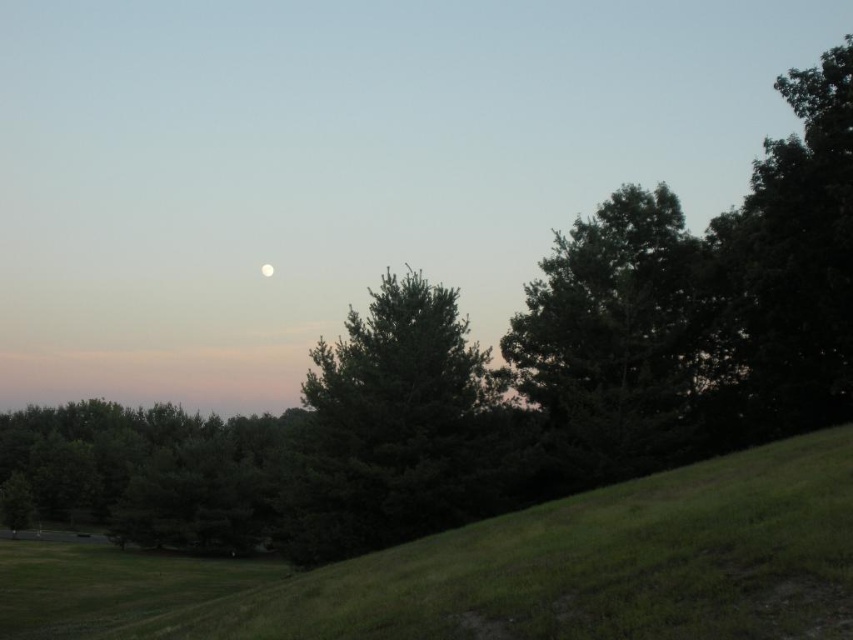
Between point (756, 198) and point (10, 474), which one is positioned in front?

Point (756, 198) is more forward.

Between point (819, 332) and point (224, 445), which one is positioned behind?

Positioned behind is point (224, 445).

I want to click on dark green leafy tree at right, so click(x=788, y=266).

Is green grassy hill at lower center above green matte tree at center?

No.

Which is more to the left, green grassy hill at lower center or green matte tree at center?

green grassy hill at lower center is more to the left.

Which is behind, point (599, 532) or point (376, 467)?

The point (376, 467) is more distant.

I want to click on green grassy hill at lower center, so click(x=502, y=570).

Does point (129, 426) come closer to viewer compared to point (265, 273)?

Yes, it is.

Does point (80, 460) come behind point (268, 275)?

No, it is not.

Is point (235, 461) positioned behind point (263, 275)?

No, (235, 461) is closer to viewer.

The image size is (853, 640). Identify the location of green leafy tree at center. (148, 470).